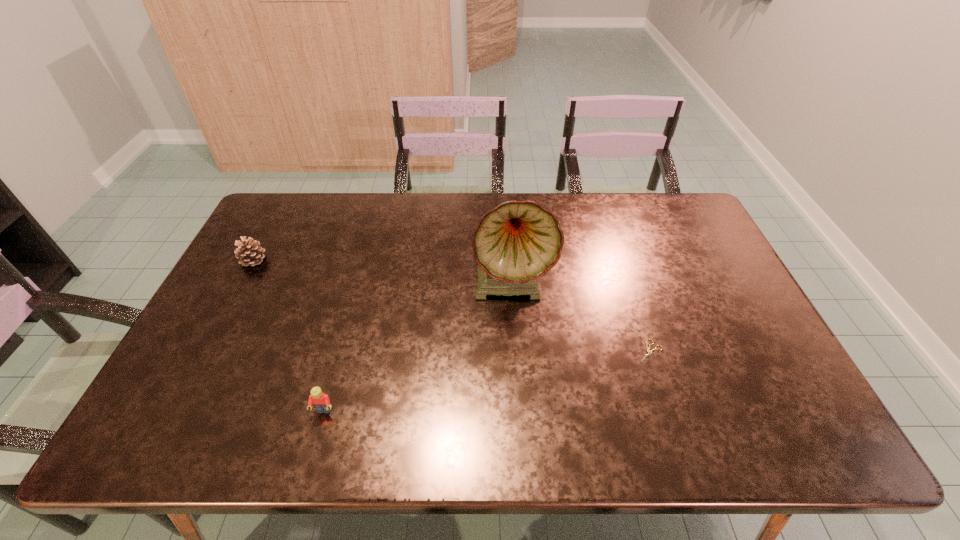
This screenshot has width=960, height=540. I want to click on vacant space that is in between the third object from right to left and the shortest object, so click(x=487, y=381).

The width and height of the screenshot is (960, 540). I want to click on vacant region between the Lego and the leftmost object, so click(289, 335).

In order to click on free space that is in between the pinecone and the nearest object in this screenshot , I will do `click(289, 335)`.

Find the location of a particular element. Image resolution: width=960 pixels, height=540 pixels. free space between the tallest object and the nearest object is located at coordinates (418, 346).

The width and height of the screenshot is (960, 540). Find the location of `empty location between the second object from right to left and the third object from right to left`. empty location between the second object from right to left and the third object from right to left is located at coordinates (418, 346).

Find the location of a particular element. This screenshot has height=540, width=960. empty space that is in between the second nearest object and the second object from left to right is located at coordinates (487, 381).

Locate an element on the screen. The height and width of the screenshot is (540, 960). free space between the rightmost object and the record player is located at coordinates (581, 316).

You are a GUI agent. You are given a task and a screenshot of the screen. Output one action in this format:
    pyautogui.click(x=<x>, y=<y>)
    Task: Click on the free space between the shortest object and the leftmost object
    Image resolution: width=960 pixels, height=540 pixels.
    Given the screenshot: What is the action you would take?
    [452, 306]

At what (x,y) coordinates should I click in order to perform the action: click on vacant point located between the third object from left to right and the pinecone. Please return your answer as a coordinate pair (x, y). Looking at the image, I should click on (382, 271).

Identify which object is the second nearest to the rightmost object. Please provide its 2D coordinates. Your answer should be formatted as a tuple, i.e. [(x, y)], where the tuple contains the x and y coordinates of a point satisfying the conditions above.

[(321, 402)]